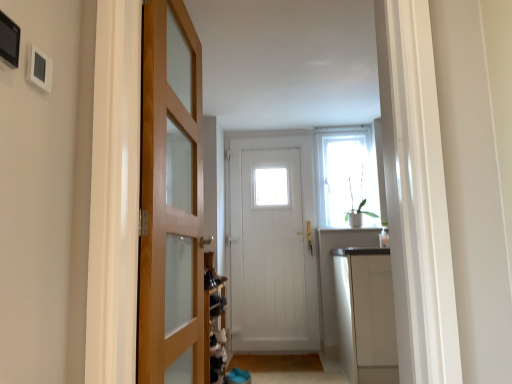
Question: From the image's perspective, is brown wooden mat at lower center, positioned as the first path in back-to-front order, on top of white glossy cabinet at right?

Choices:
 (A) yes
 (B) no

Answer: (B)

Question: Is the position of brown wooden mat at lower center, positioned as the first path in back-to-front order, less distant than that of white glossy cabinet at right?

Choices:
 (A) no
 (B) yes

Answer: (A)

Question: From a real-world perspective, is brown wooden mat at lower center, the 2th path viewed from the front, under white glossy cabinet at right?

Choices:
 (A) no
 (B) yes

Answer: (B)

Question: Does brown wooden mat at lower center, positioned as the first path in back-to-front order, have a larger size compared to white glossy cabinet at right?

Choices:
 (A) yes
 (B) no

Answer: (B)

Question: Is brown wooden mat at lower center, positioned as the first path in back-to-front order, further to camera compared to white glossy cabinet at right?

Choices:
 (A) yes
 (B) no

Answer: (A)

Question: Can you confirm if brown wooden mat at lower center, the 2th path viewed from the front, is taller than white glossy cabinet at right?

Choices:
 (A) yes
 (B) no

Answer: (B)

Question: Considering the relative sizes of wooden door at left, the second door when ordered from back to front, and white wooden door at center, the second door from the left, in the image provided, is wooden door at left, the second door when ordered from back to front, shorter than white wooden door at center, the second door from the left,?

Choices:
 (A) no
 (B) yes

Answer: (B)

Question: From a real-world perspective, is wooden door at left, the 2th door when ordered from right to left, over white wooden door at center, arranged as the 2th door when viewed from the front?

Choices:
 (A) yes
 (B) no

Answer: (A)

Question: Is wooden door at left, the first door when ordered from front to back, facing towards white wooden door at center, the second door from the left?

Choices:
 (A) yes
 (B) no

Answer: (B)

Question: From the image's perspective, is wooden door at left, the first door when ordered from front to back, below white wooden door at center, arranged as the 2th door when viewed from the front?

Choices:
 (A) yes
 (B) no

Answer: (B)

Question: Is wooden door at left, which appears as the first door when viewed from the left, thinner than white wooden door at center, marked as the 1th door in a right-to-left arrangement?

Choices:
 (A) no
 (B) yes

Answer: (A)

Question: From the image's perspective, would you say wooden door at left, the 2th door when ordered from right to left, is positioned over white wooden door at center, the second door from the left?

Choices:
 (A) no
 (B) yes

Answer: (B)

Question: From a real-world perspective, is brown wooden mat at lower center, positioned as the first path in back-to-front order, physically above brown carpet at lower center, acting as the 2th path starting from the back?

Choices:
 (A) no
 (B) yes

Answer: (A)